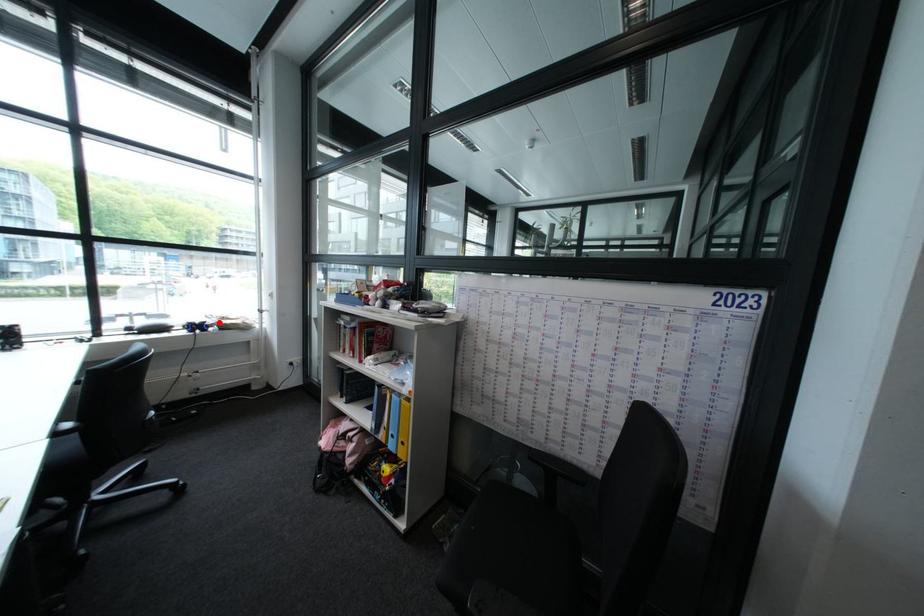
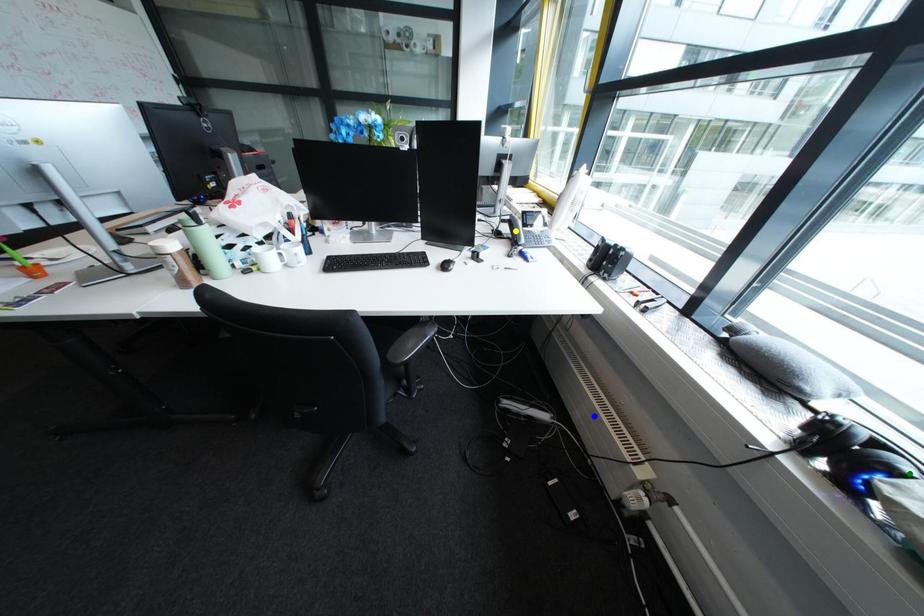
Question: I am providing you with two images of the same scene from different viewpoints. A red point is marked on the first image. You are given multiple points on the second image. Can you choose the point in image 2 that corresponds to the point in image 1?

Choices:
 (A) blue point
 (B) yellow point
 (C) green point

Answer: (C)